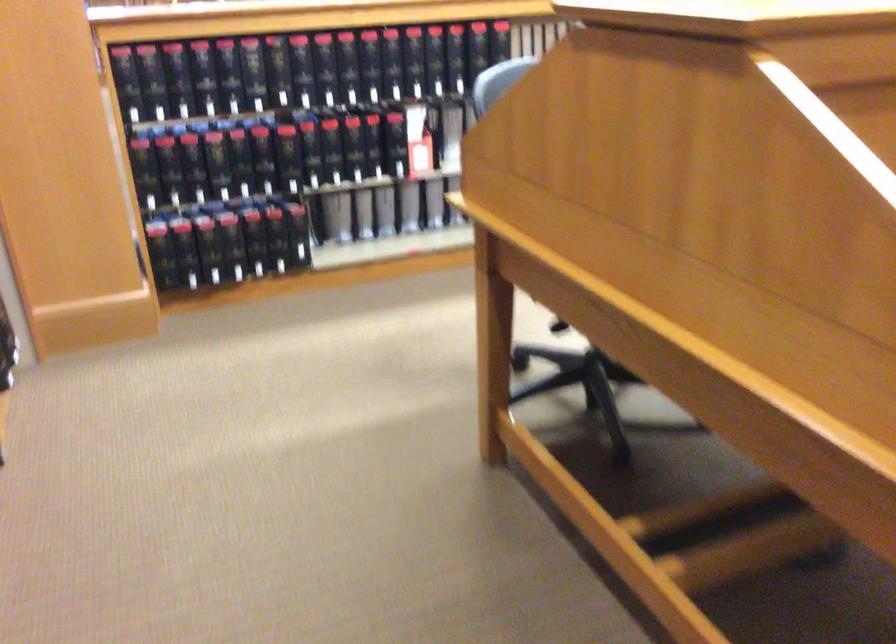
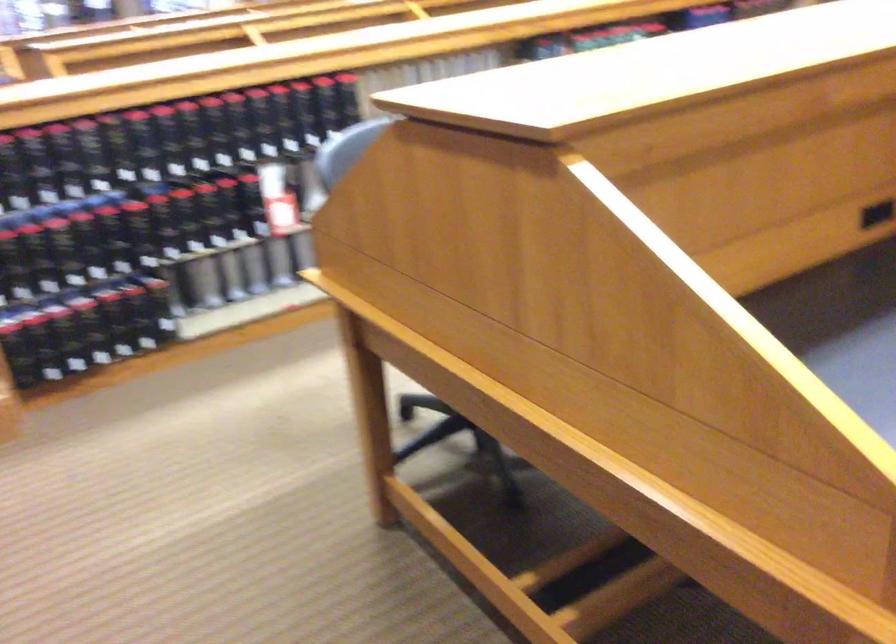
The point at (228,245) is marked in the first image. Where is the corresponding point in the second image?

(87, 328)